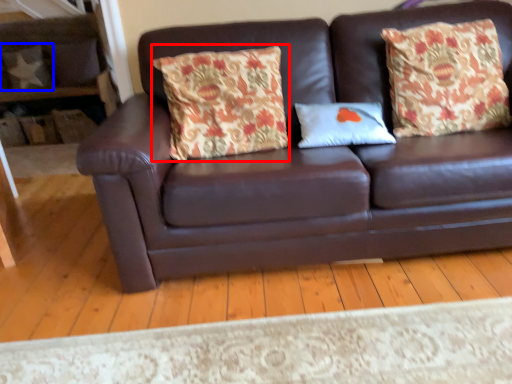
Question: Among these objects, which one is nearest to the camera, throw pillow (highlighted by a red box) or pillow (highlighted by a blue box)?

Choices:
 (A) throw pillow
 (B) pillow

Answer: (A)